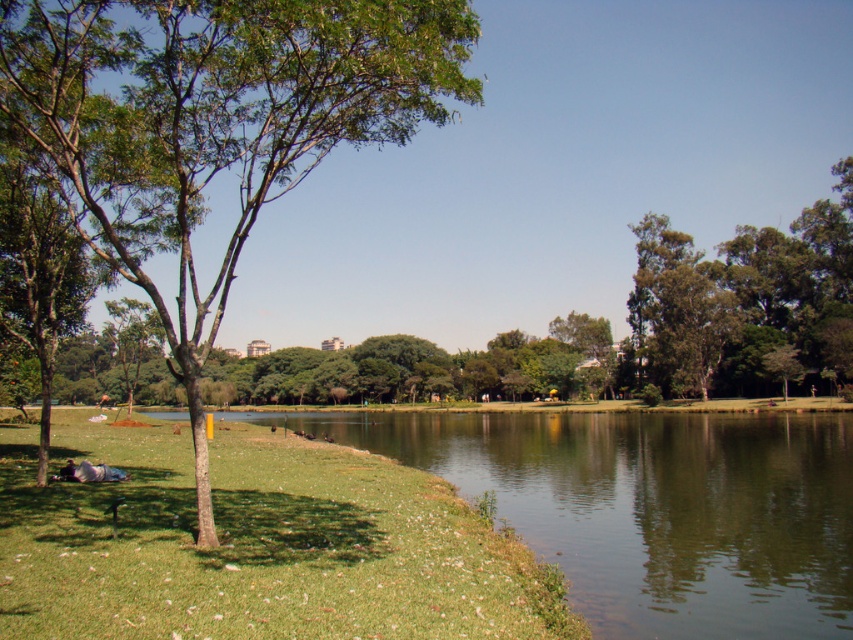
You are standing at the center of the park and want to find the green grassy at lower left. Which direction should you look to locate it?

The green grassy at lower left is located at point [254,545], so you should look towards the lower left direction to find it.

You are a photographer wanting to capture the green grassy at lower left and the green leafy tree at left in the same frame. Since you can only focus on one object clearly, which one should you focus on to ensure it appears sharp in the photo?

You should focus on the green leafy tree at left because it is further away than the green grassy at lower left, so focusing on the farther object ensures both will be in focus due to the depth of field.

You are planning to set up a picnic blanket in the park. The picnic blanket is 2 meters wide. There is a green grassy at lower left and a green leafy tree at left. Which area would be more suitable for placing the blanket without obstructing the view of the tree?

The green grassy at lower left has a smaller size compared to the green leafy tree at left. Since the grassy area is smaller, it might not provide enough space for the 2 meter wide picnic blanket. The area around the green leafy tree at left, being larger, would be more suitable for placing the blanket while keeping the tree in view.